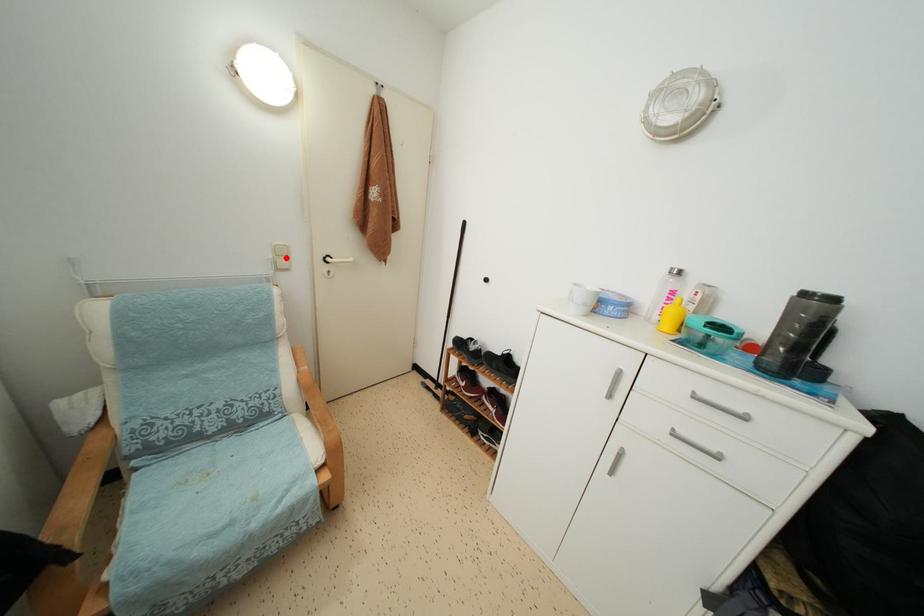
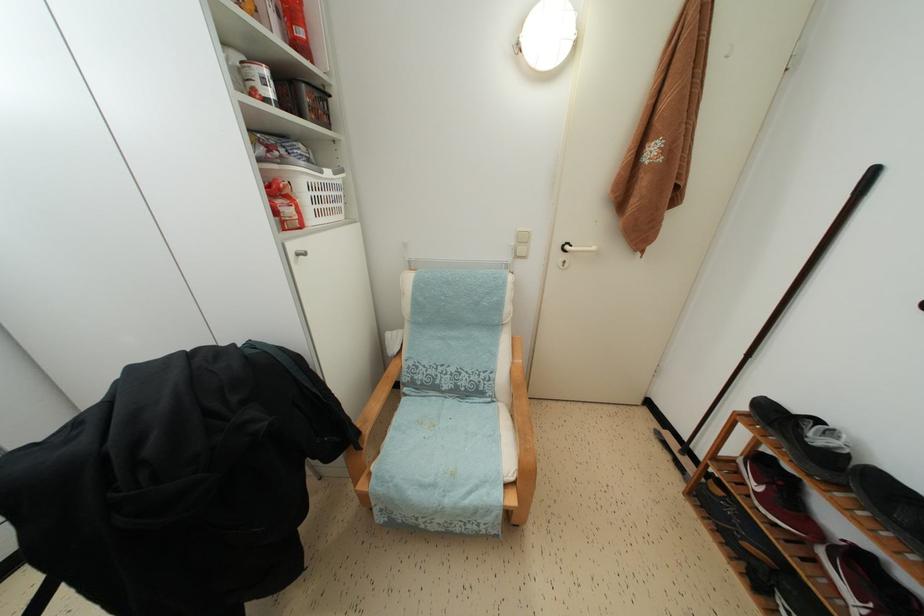
Find the pixel in the second image that matches the highlighted location in the first image.

(527, 245)